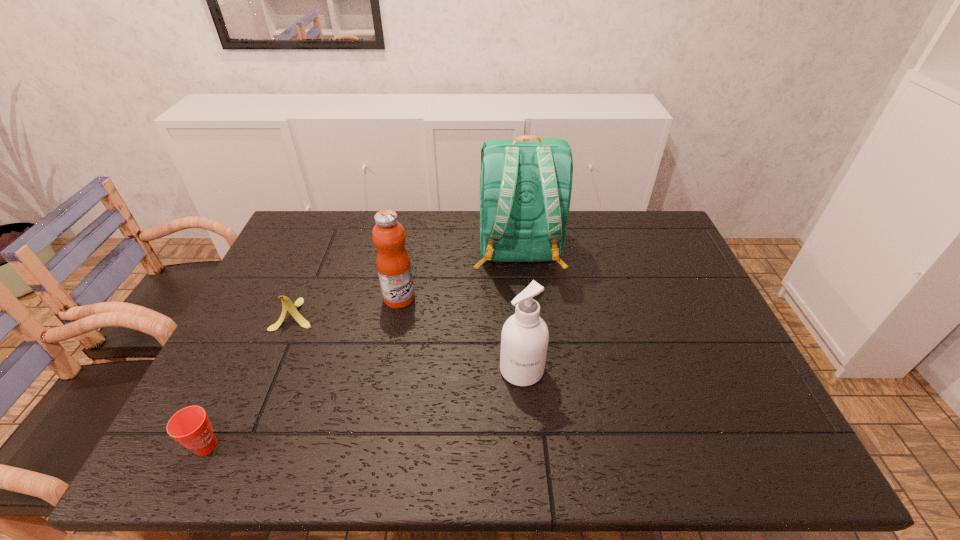
Image resolution: width=960 pixels, height=540 pixels. In order to click on the tallest object in this screenshot , I will do `click(525, 187)`.

Find the location of a particular element. This screenshot has width=960, height=540. backpack is located at coordinates (525, 187).

Where is `the third object from right to left`? The height and width of the screenshot is (540, 960). the third object from right to left is located at coordinates (393, 263).

Image resolution: width=960 pixels, height=540 pixels. In order to click on the fourth farthest object in this screenshot , I will do `click(524, 339)`.

Locate an element on the screen. The image size is (960, 540). banana is located at coordinates (288, 306).

Where is `cup`? Image resolution: width=960 pixels, height=540 pixels. cup is located at coordinates (190, 426).

I want to click on free space located 0.120m on the back of the farthest object, so click(x=525, y=313).

Image resolution: width=960 pixels, height=540 pixels. Find the location of `blank space located on the front label of the third object from left to right`. blank space located on the front label of the third object from left to right is located at coordinates (533, 298).

You are a GUI agent. You are given a task and a screenshot of the screen. Output one action in this format:
    pyautogui.click(x=<x>, y=<y>)
    Task: Click on the vacant region located 0.110m on the front label of the cleansing agent
    The height and width of the screenshot is (540, 960).
    Given the screenshot: What is the action you would take?
    pyautogui.click(x=527, y=431)

Locate an element on the screen. vacant space located on the back of the banana is located at coordinates (311, 279).